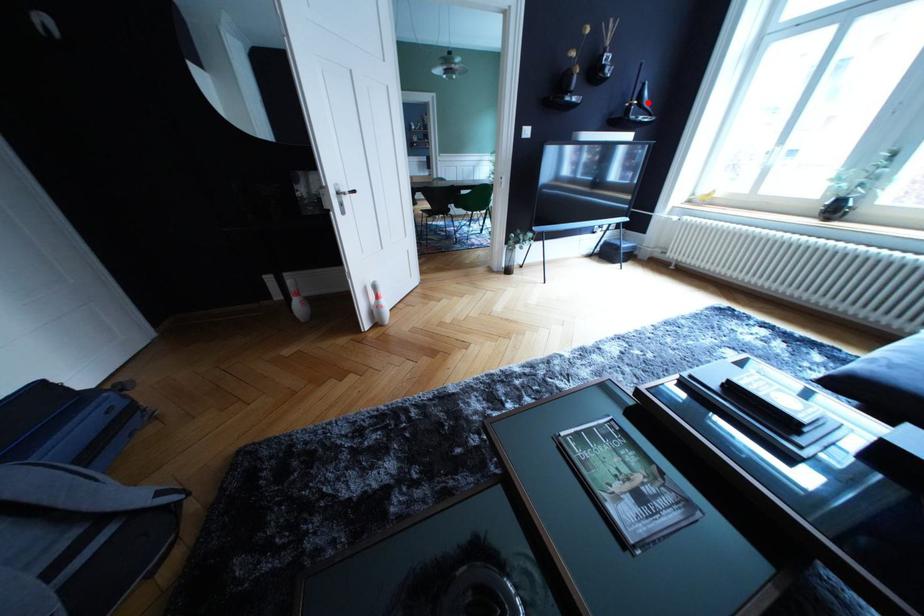
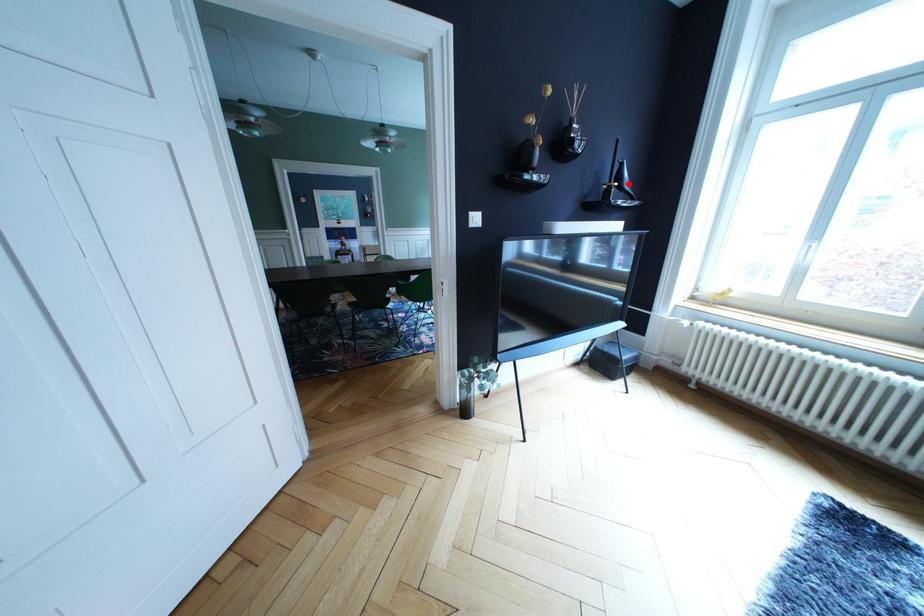
I am providing you with two images of the same scene from different viewpoints. A red point is marked on the first image and another point is marked on the second image. Do the highlighted points in image1 and image2 indicate the same real-world spot?

Yes